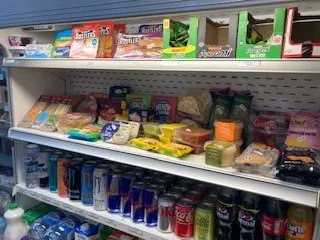
In order to click on store shelf in this screenshot , I will do point(154,59), point(129,156), point(112,218).